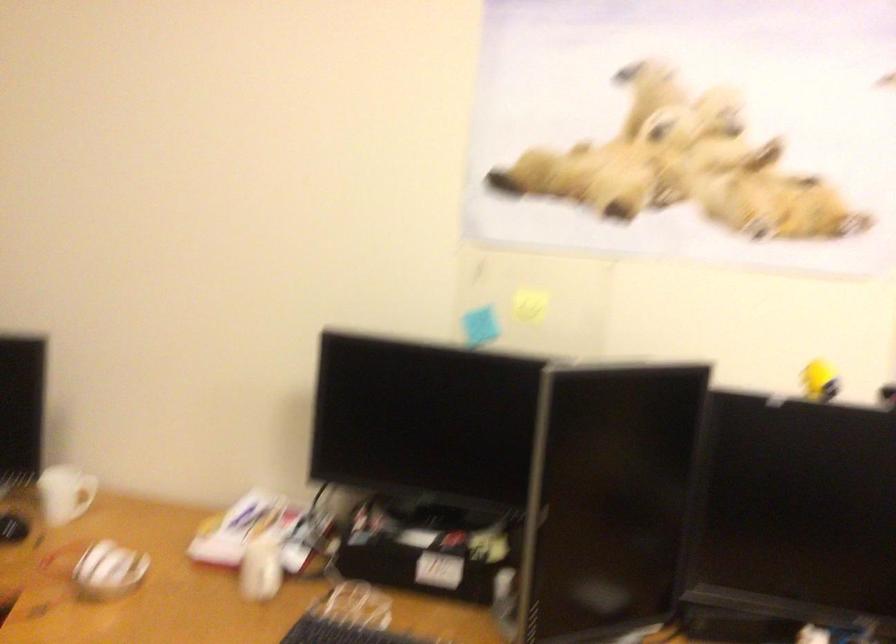
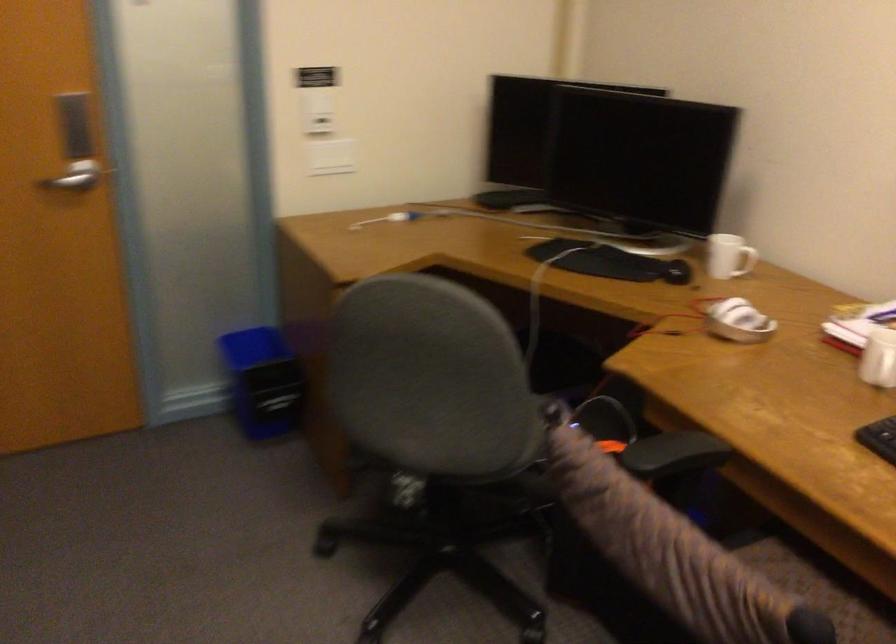
Where in the second image is the point corresponding to point 257,574 from the first image?

(879, 363)